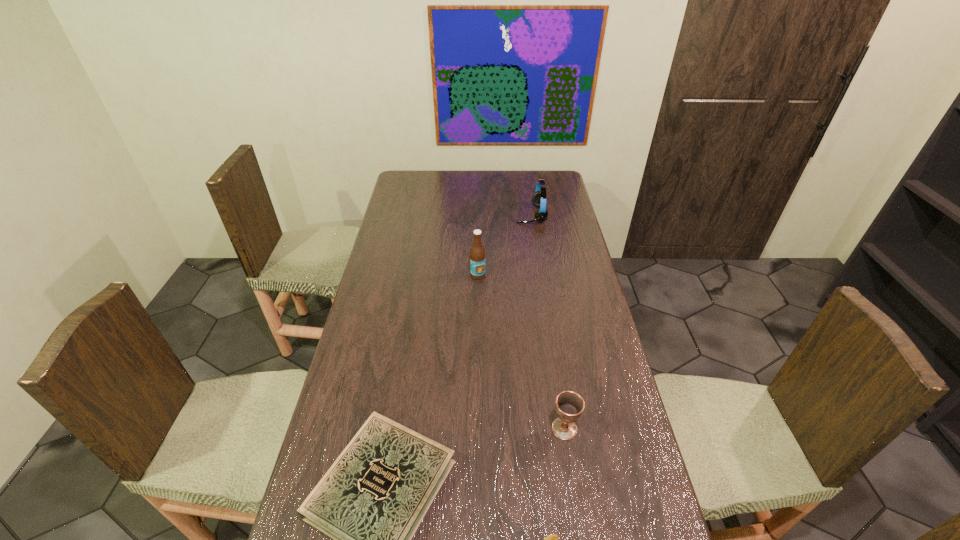
Find the location of `the second farthest object`. the second farthest object is located at coordinates (477, 253).

Where is `the second object from left to right`? the second object from left to right is located at coordinates (477, 253).

Locate an element on the screen. This screenshot has height=540, width=960. the second tallest object is located at coordinates (539, 197).

At what (x,y) coordinates should I click in order to perform the action: click on the farthest object. Please return your answer as a coordinate pair (x, y). Looking at the image, I should click on (539, 197).

The height and width of the screenshot is (540, 960). I want to click on the third shortest object, so pyautogui.click(x=569, y=405).

This screenshot has height=540, width=960. Find the location of `vacant area situated on the right of the beer bottle`. vacant area situated on the right of the beer bottle is located at coordinates (498, 275).

At what (x,y) coordinates should I click in order to perform the action: click on vacant position located with the microphone attached to the side of the headset. Please return your answer as a coordinate pair (x, y). The width and height of the screenshot is (960, 540). Looking at the image, I should click on (444, 214).

Find the location of a particular element. free spot located with the microphone attached to the side of the headset is located at coordinates (500, 214).

This screenshot has height=540, width=960. I want to click on vacant space located with the microphone attached to the side of the headset, so click(x=478, y=214).

The width and height of the screenshot is (960, 540). What are the coordinates of `vacant region located 0.380m on the left of the chalice` in the screenshot? It's located at (410, 429).